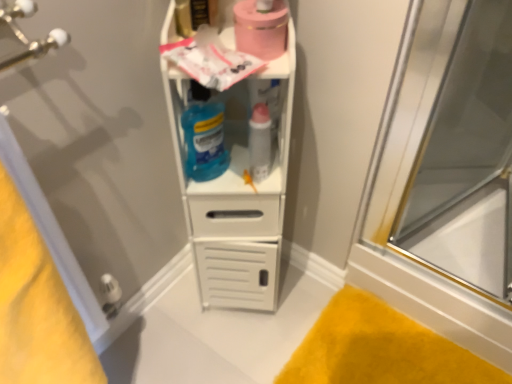
Identify the location of vacant space that's between white plastic shelf at center and yellow plush bath mat at lower right. (282, 317).